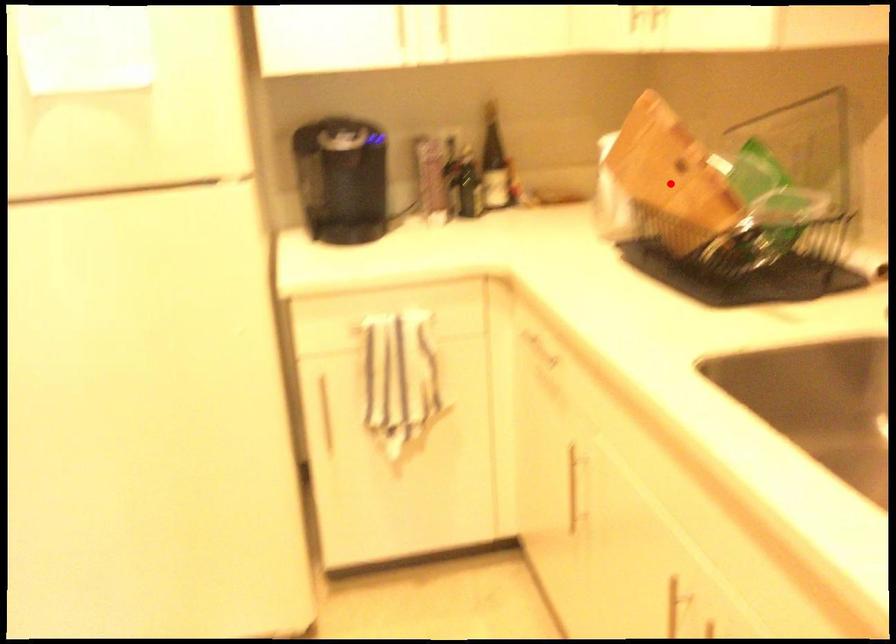
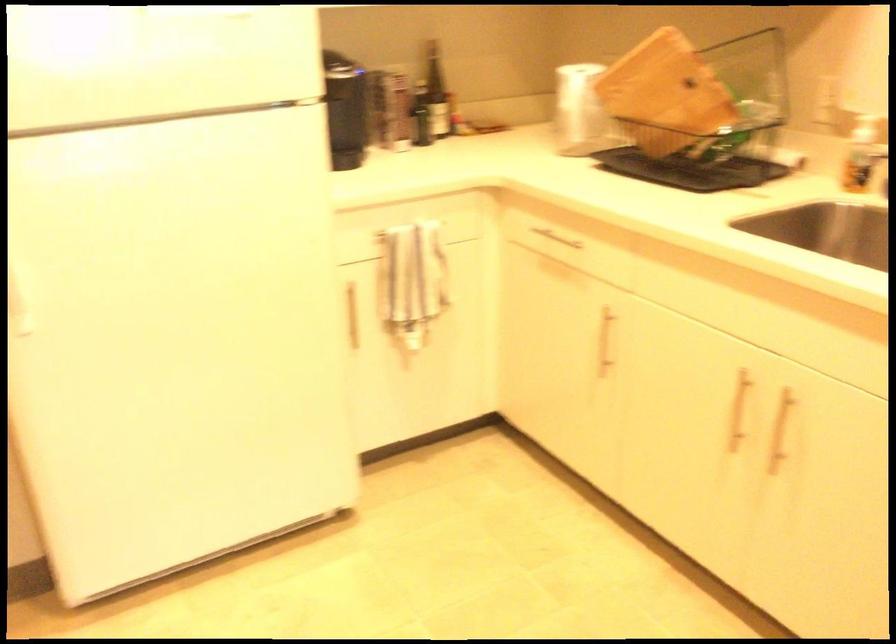
Question: I am providing you with two images of the same scene from different viewpoints. A red point is shown in image1. For the corresponding object point in image2, is it positioned nearer or farther from the camera?

Choices:
 (A) Nearer
 (B) Farther

Answer: (B)